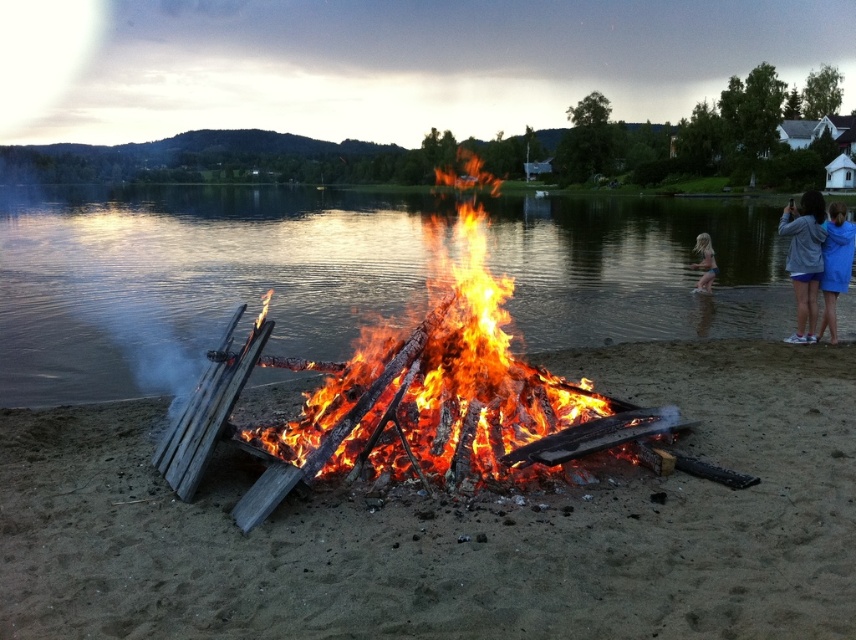
You are planning to cross the lake using a small boat that can only handle calm waters. Based on the scene, can you determine if the transparent water at center is wide enough to accommodate the boat while avoiding the charred wood fire at center?

The transparent water at center is wider than the charred wood fire at center, so yes, the boat can navigate through the transparent water at center while avoiding the charred wood fire at center since there is sufficient width available.